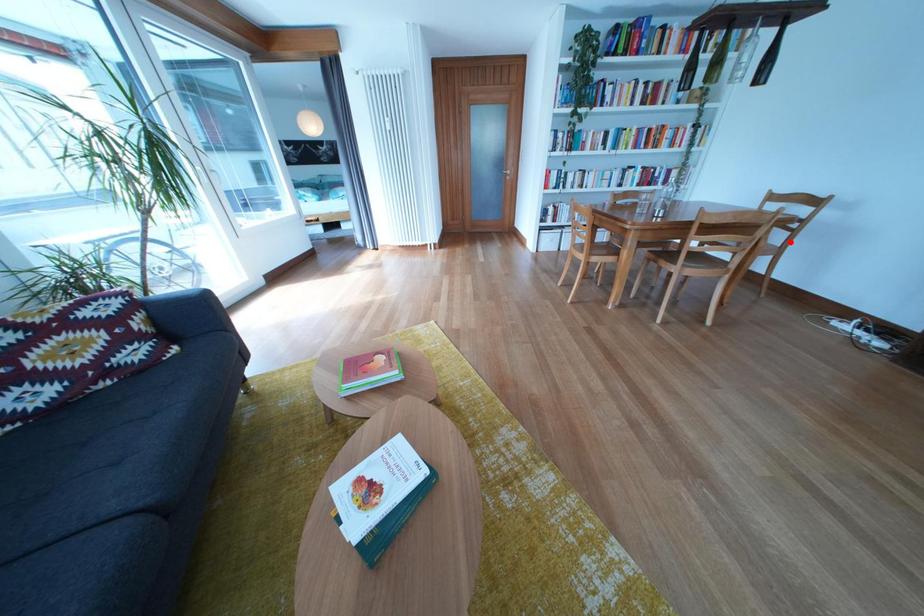
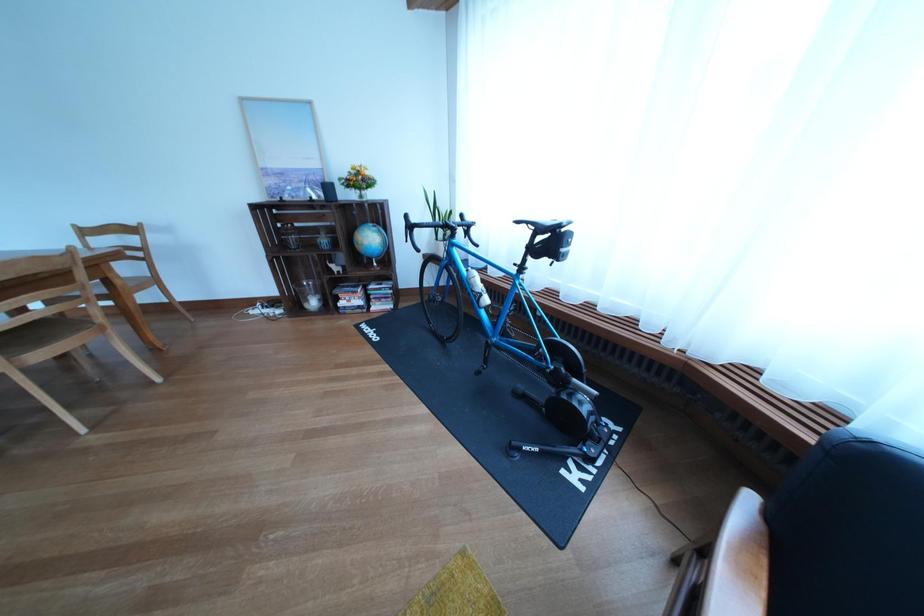
The point at the highlighted location is marked in the first image. Where is the corresponding point in the second image?

(141, 276)